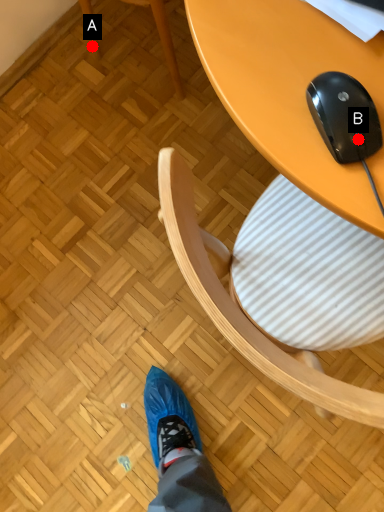
Question: Two points are circled on the image, labeled by A and B beside each circle. Which point is closer to the camera?

Choices:
 (A) A is closer
 (B) B is closer

Answer: (B)